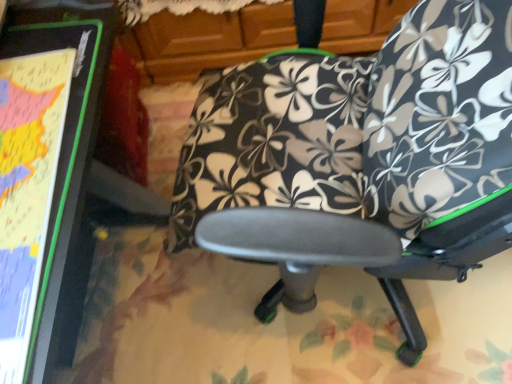
Question: Is matte black board at left positioned beyond the bounds of black floral fabric bean bag chair at center?

Choices:
 (A) yes
 (B) no

Answer: (A)

Question: Does matte black board at left have a greater width compared to black floral fabric bean bag chair at center?

Choices:
 (A) yes
 (B) no

Answer: (A)

Question: From a real-world perspective, is matte black board at left located beneath black floral fabric bean bag chair at center?

Choices:
 (A) no
 (B) yes

Answer: (B)

Question: Is matte black board at left to the right of black floral fabric bean bag chair at center from the viewer's perspective?

Choices:
 (A) yes
 (B) no

Answer: (B)

Question: Is matte black board at left to the left of black floral fabric bean bag chair at center from the viewer's perspective?

Choices:
 (A) no
 (B) yes

Answer: (B)

Question: Is point (451, 23) closer or farther from the camera than point (380, 72)?

Choices:
 (A) closer
 (B) farther

Answer: (A)

Question: From the image's perspective, relative to black fabric chair at center, is black floral fabric bean bag chair at center above or below?

Choices:
 (A) below
 (B) above

Answer: (B)

Question: Considering the relative positions of black floral fabric bean bag chair at center and black fabric chair at center in the image provided, is black floral fabric bean bag chair at center to the left or to the right of black fabric chair at center?

Choices:
 (A) right
 (B) left

Answer: (A)

Question: From a real-world perspective, is black floral fabric bean bag chair at center above or below black fabric chair at center?

Choices:
 (A) below
 (B) above

Answer: (B)

Question: Is matte black board at left in front of or behind black floral fabric bean bag chair at center in the image?

Choices:
 (A) front
 (B) behind

Answer: (A)

Question: Looking at their shapes, would you say matte black board at left is wider or thinner than black floral fabric bean bag chair at center?

Choices:
 (A) wide
 (B) thin

Answer: (A)

Question: Is point (30, 225) closer or farther from the camera than point (462, 205)?

Choices:
 (A) farther
 (B) closer

Answer: (B)

Question: From the image's perspective, relative to black floral fabric bean bag chair at center, is matte black board at left above or below?

Choices:
 (A) above
 (B) below

Answer: (B)

Question: Is black fabric chair at center in front of or behind matte black board at left in the image?

Choices:
 (A) behind
 (B) front

Answer: (B)

Question: Considering the positions of black fabric chair at center and matte black board at left in the image, is black fabric chair at center wider or thinner than matte black board at left?

Choices:
 (A) wide
 (B) thin

Answer: (A)